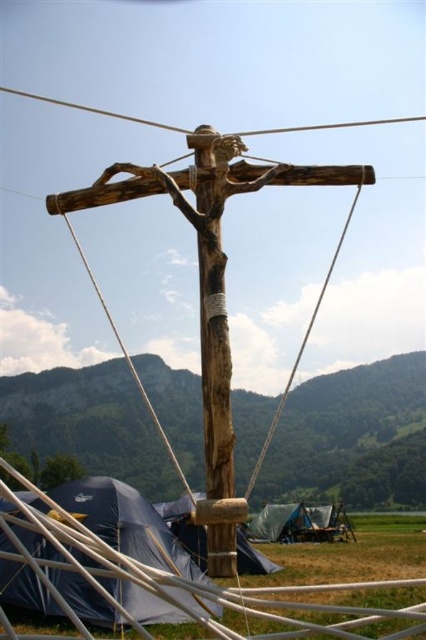
Which is more to the right, blue fabric tent at lower left or blue fabric tent at center?

From the viewer's perspective, blue fabric tent at center appears more on the right side.

Which is behind, point (129, 584) or point (204, 544)?

The point (204, 544) is behind.

Identify the location of blue fabric tent at lower left. (126, 522).

Find the location of a particular element. natural wood cross at center is located at coordinates (209, 289).

Between natural wood cross at center and natural wood rope at center, which one appears on the left side from the viewer's perspective?

natural wood cross at center

What do you see at coordinates (209, 289) in the screenshot?
I see `natural wood cross at center` at bounding box center [209, 289].

I want to click on natural wood cross at center, so 209,289.

Who is more forward, (409, 122) or (314, 316)?

Point (314, 316)

Does smooth wire at upper center have a greater width compared to natural wood rope at center?

Correct, the width of smooth wire at upper center exceeds that of natural wood rope at center.

Does point (180, 129) lie behind point (258, 458)?

No.

Find the location of a particular element. This screenshot has height=640, width=426. smooth wire at upper center is located at coordinates (97, 109).